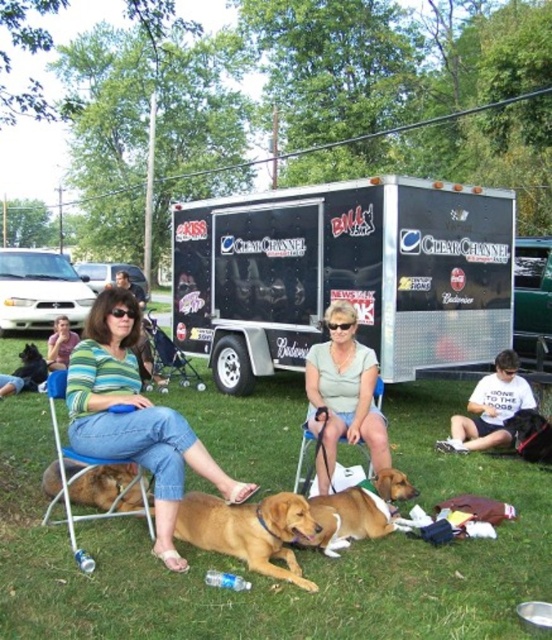
This screenshot has height=640, width=552. Find the location of `striped knit sweater at center`. striped knit sweater at center is located at coordinates click(135, 417).

Can you confirm if striped knit sweater at center is positioned above golden brown fur at center?

Indeed, striped knit sweater at center is positioned over golden brown fur at center.

Does point (163, 477) come in front of point (189, 499)?

Yes, it is.

Locate an element on the screen. This screenshot has height=640, width=552. striped knit sweater at center is located at coordinates (135, 417).

This screenshot has width=552, height=640. I want to click on black glossy dog at lower right, so click(x=530, y=435).

Does black glossy dog at lower right appear under black fur dog at lower left?

Correct, black glossy dog at lower right is located below black fur dog at lower left.

Is point (527, 422) farther from camera compared to point (43, 374)?

No, (527, 422) is in front of (43, 374).

Identify the location of black glossy dog at lower right. This screenshot has width=552, height=640. (530, 435).

Is green matte shirt at center in front of black fur dog at lower left?

Yes, green matte shirt at center is closer to the viewer.

Based on the photo, is green matte shirt at center to the left of black fur dog at lower left from the viewer's perspective?

Incorrect, green matte shirt at center is not on the left side of black fur dog at lower left.

Identify the location of green matte shirt at center. (343, 394).